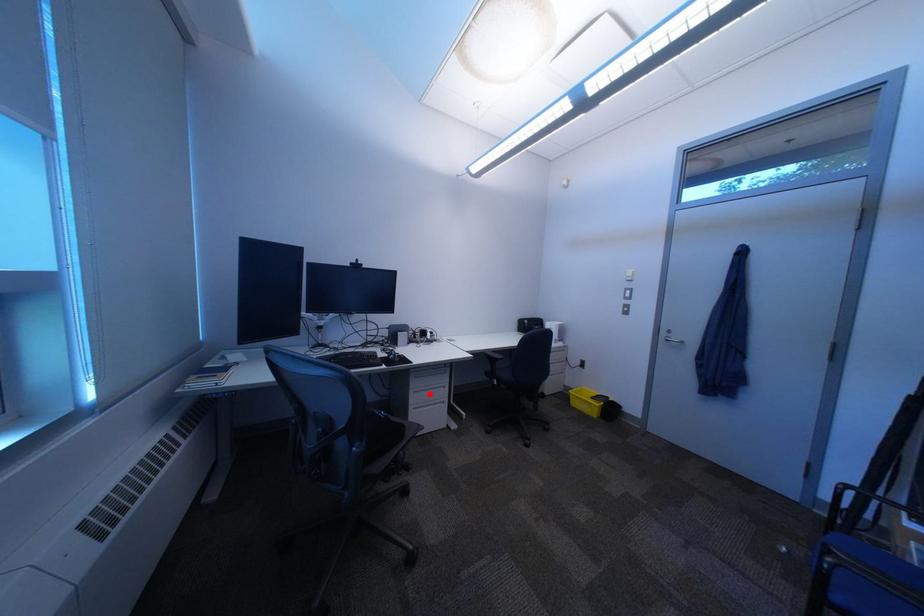
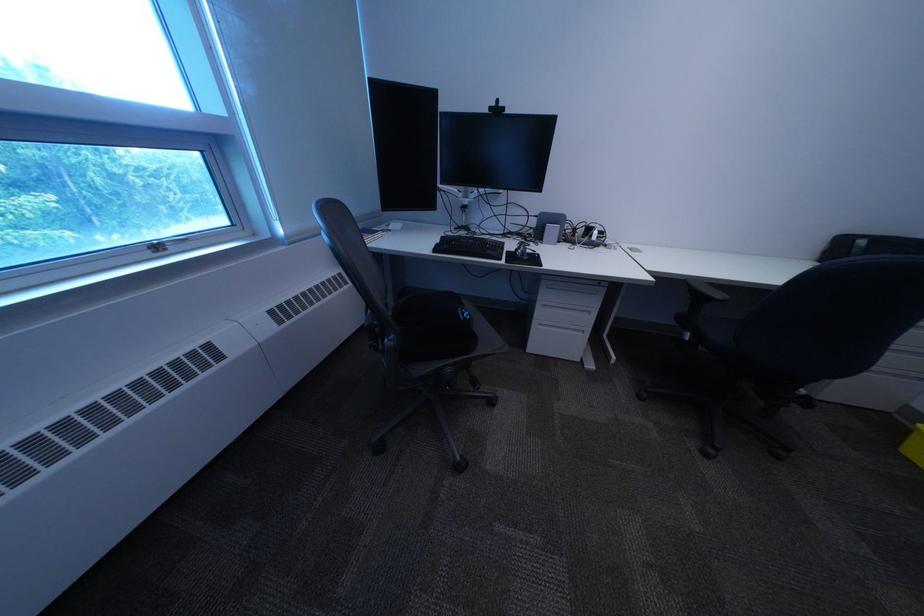
Question: I am providing you with two images of the same scene from different viewpoints. A red point is marked on the first image. Is the red point's position out of view in image 2?

Choices:
 (A) Yes
 (B) No

Answer: (B)